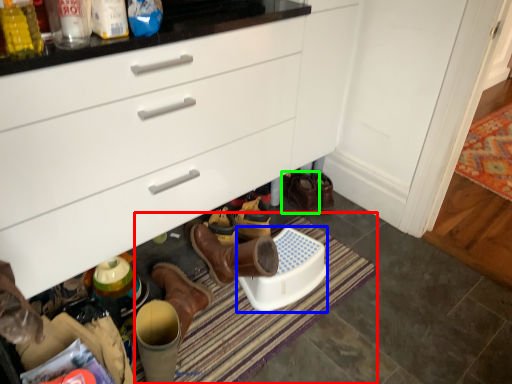
Question: Estimate the real-world distances between objects in this image. Which object is closer to bath mat (highlighted by a red box), corded phone (highlighted by a blue box) or footwear (highlighted by a green box)?

Choices:
 (A) corded phone
 (B) footwear

Answer: (A)